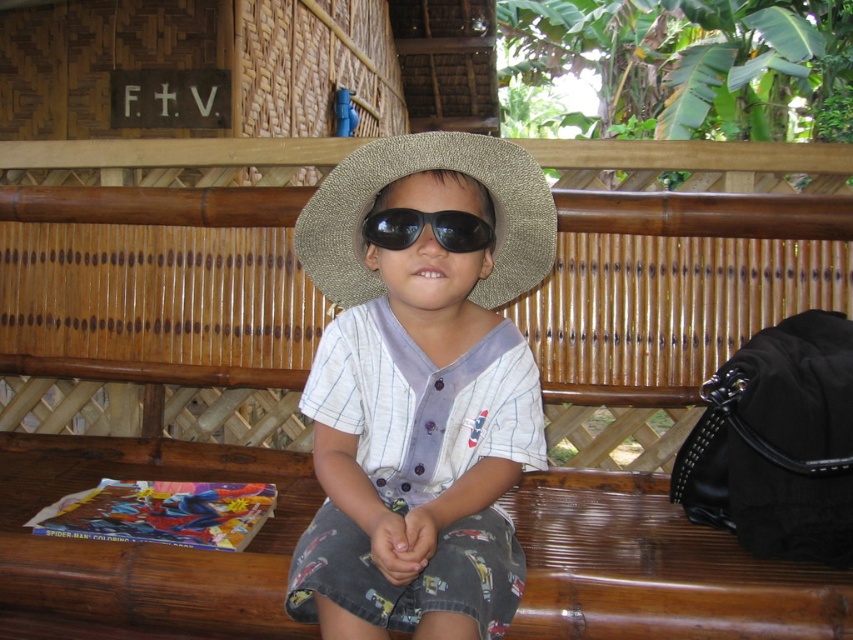
Between point (329, 353) and point (347, 285), which one is positioned behind?

The point (347, 285) is more distant.

Consider the image. Can you confirm if matte straw hat at center is positioned to the right of natural straw hat at center?

In fact, matte straw hat at center is to the left of natural straw hat at center.

Is point (440, 371) more distant than point (320, 248)?

No.

Where is `matte straw hat at center`? matte straw hat at center is located at coordinates (421, 390).

Who is higher up, matte straw hat at center or black matte sunglasses at center?

Positioned higher is black matte sunglasses at center.

Describe the element at coordinates (421, 390) in the screenshot. I see `matte straw hat at center` at that location.

Measure the distance between matte straw hat at center and camera.

matte straw hat at center and camera are 4.06 feet apart from each other.

Find the location of `matte straw hat at center`. matte straw hat at center is located at coordinates (421, 390).

Between point (453, 136) and point (399, 234), which one is positioned behind?

The point (399, 234) is more distant.

How far apart are natural straw hat at center and black matte sunglasses at center?

4.58 inches

Where is `natural straw hat at center`? This screenshot has width=853, height=640. natural straw hat at center is located at coordinates (422, 172).